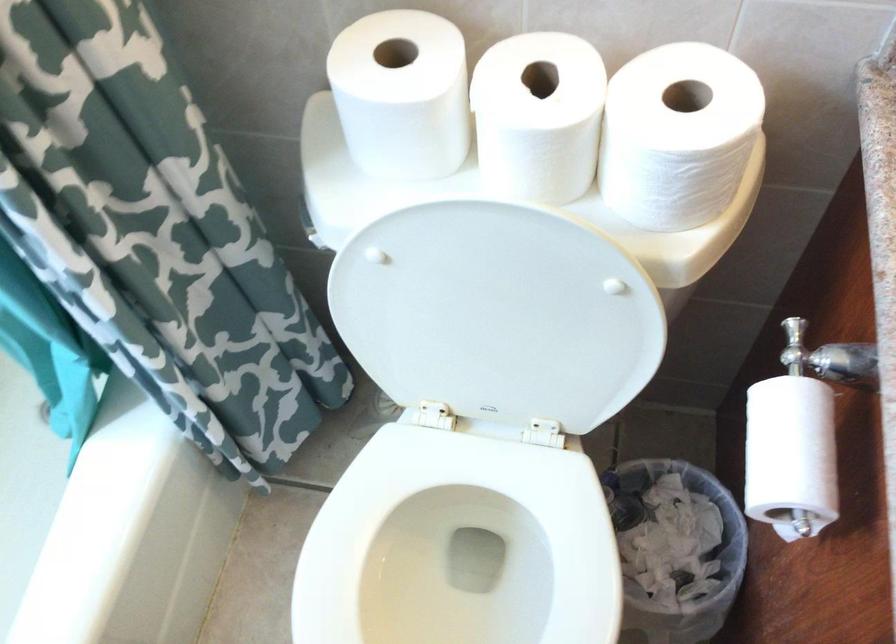
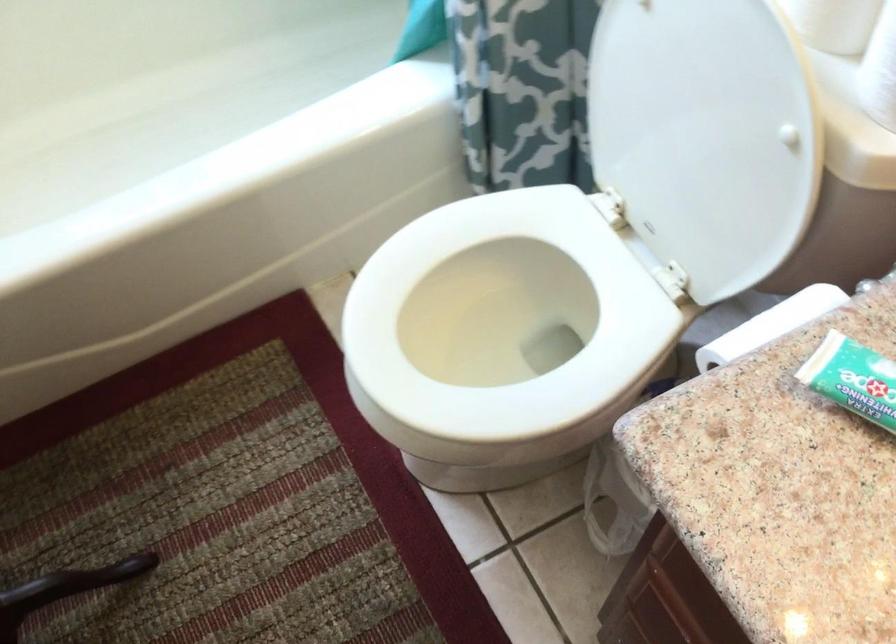
The point at (642, 200) is marked in the first image. Where is the corresponding point in the second image?

(880, 70)